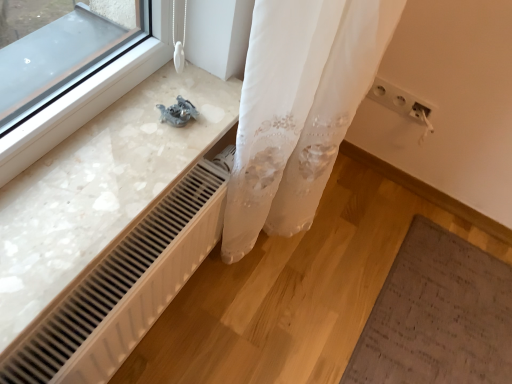
Question: Is white plastic radiator at lower center in front of or behind white plastic electric outlet at upper right in the image?

Choices:
 (A) front
 (B) behind

Answer: (A)

Question: From their relative heights in the image, would you say white plastic radiator at lower center is taller or shorter than white plastic electric outlet at upper right?

Choices:
 (A) short
 (B) tall

Answer: (B)

Question: From the image's perspective, is white plastic radiator at lower center above or below white plastic electric outlet at upper right?

Choices:
 (A) below
 (B) above

Answer: (A)

Question: Considering the positions of point (376, 89) and point (31, 329), is point (376, 89) closer or farther from the camera than point (31, 329)?

Choices:
 (A) farther
 (B) closer

Answer: (A)

Question: Is white plastic electric outlet at upper right bigger or smaller than white plastic radiator at lower center?

Choices:
 (A) small
 (B) big

Answer: (A)

Question: Looking at their shapes, would you say white plastic electric outlet at upper right is wider or thinner than white plastic radiator at lower center?

Choices:
 (A) thin
 (B) wide

Answer: (A)

Question: From the image's perspective, is white plastic electric outlet at upper right above or below white plastic radiator at lower center?

Choices:
 (A) below
 (B) above

Answer: (B)